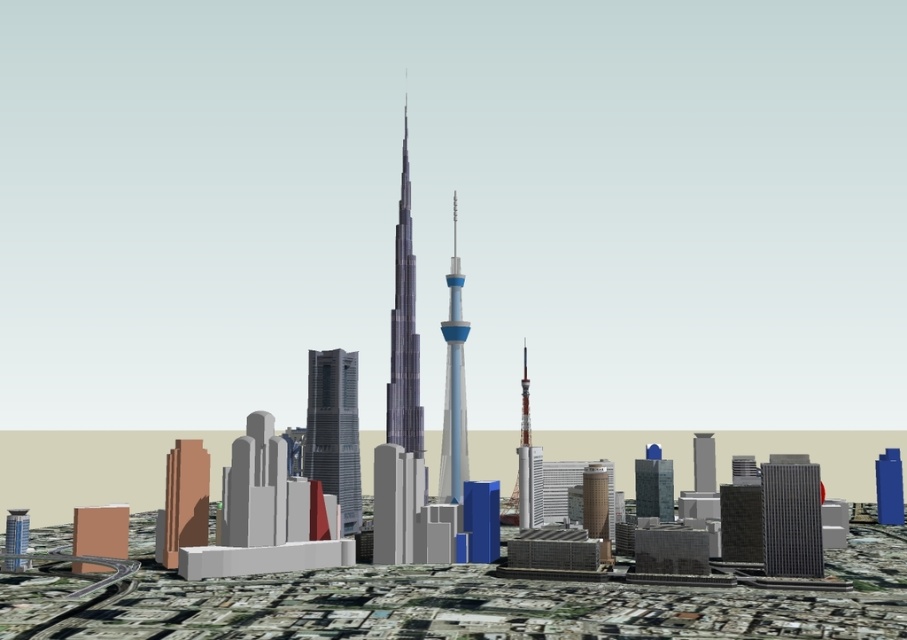
Which of these two, shiny metallic skyscraper at center or dark gray glass skyscraper at center right, stands shorter?

With less height is dark gray glass skyscraper at center right.

Identify the location of shiny metallic skyscraper at center. The height and width of the screenshot is (640, 907). (334, 432).

Who is shorter, shiny glass skyscraper at center or blue glass tower at center?

Standing shorter between the two is blue glass tower at center.

Which is in front, point (408, 253) or point (459, 440)?

Point (408, 253) is more forward.

At what (x,y) coordinates should I click in order to perform the action: click on shiny glass skyscraper at center. Please return your answer as a coordinate pair (x, y). Looking at the image, I should click on (405, 328).

Does metallic silver tower at center come behind metallic glass skyscraper at center?

No, metallic silver tower at center is closer to the viewer.

Does metallic silver tower at center have a greater height compared to metallic glass skyscraper at center?

Correct, metallic silver tower at center is much taller as metallic glass skyscraper at center.

The height and width of the screenshot is (640, 907). What do you see at coordinates (527, 465) in the screenshot?
I see `metallic silver tower at center` at bounding box center [527, 465].

Locate an element on the screen. Image resolution: width=907 pixels, height=640 pixels. metallic silver tower at center is located at coordinates (527, 465).